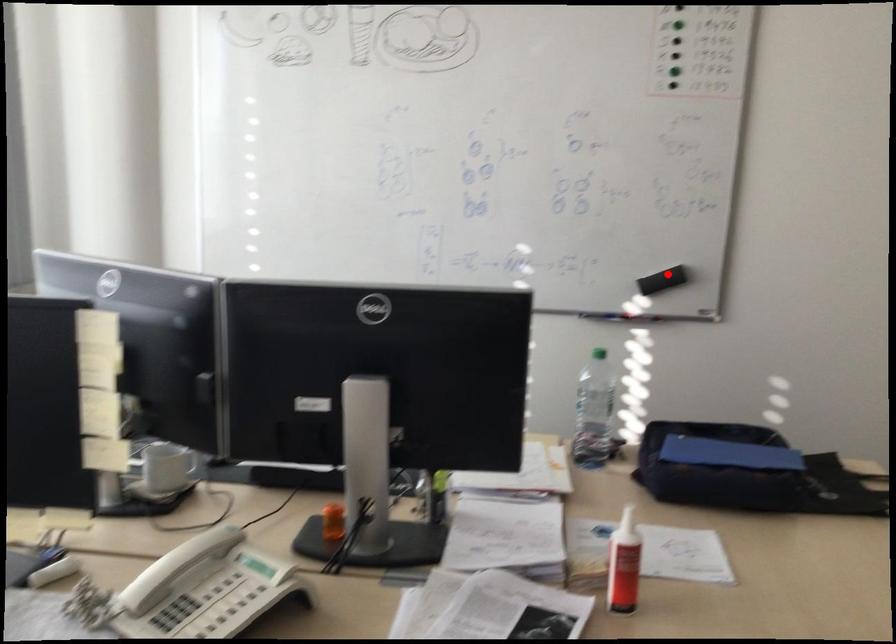
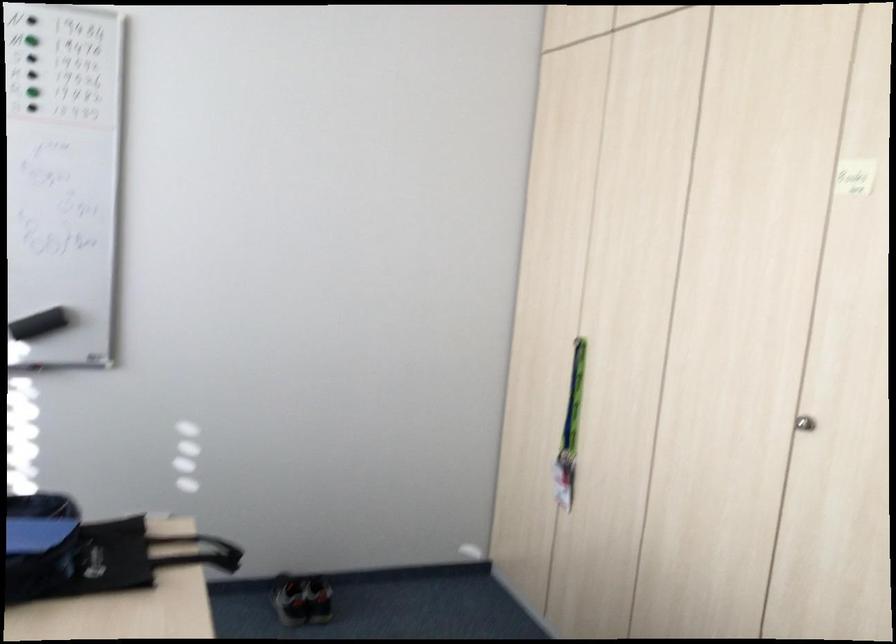
The point at the highlighted location is marked in the first image. Where is the corresponding point in the second image?

(39, 324)